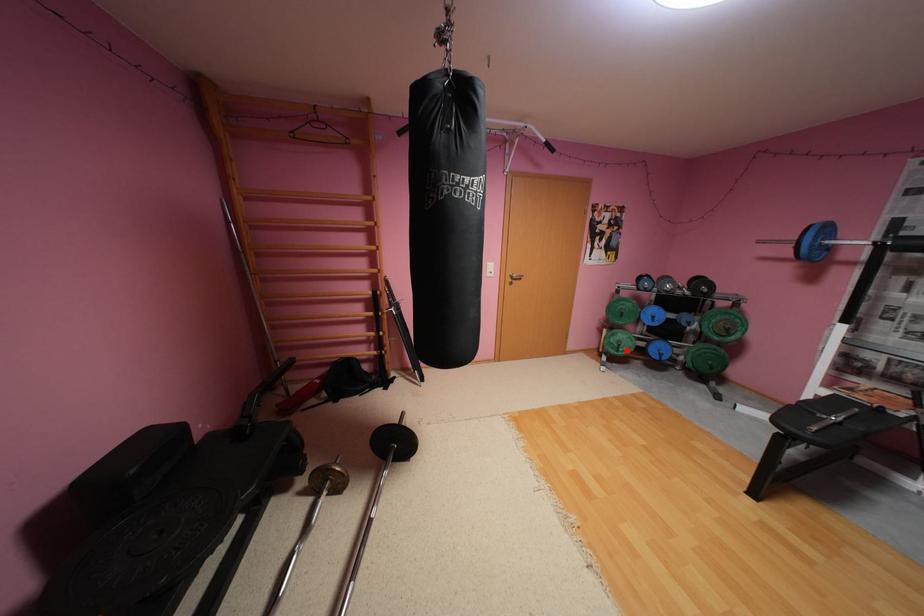
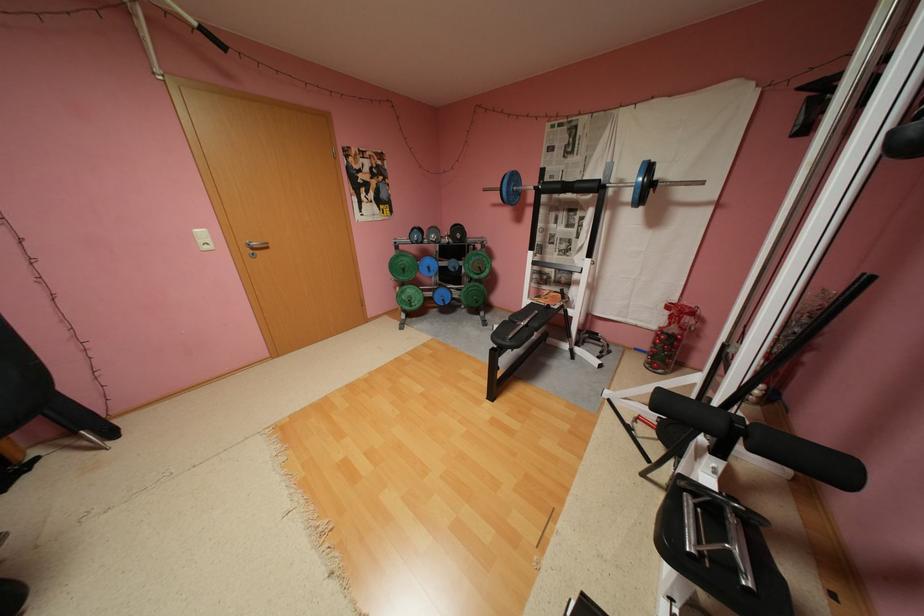
Where in the second image is the point corresponding to the highlighted location from the first image?

(419, 306)